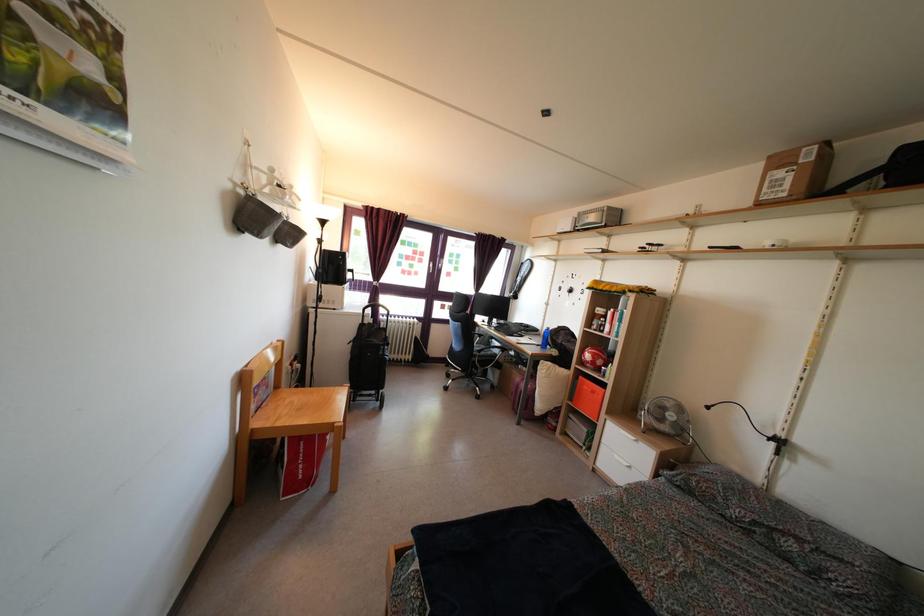
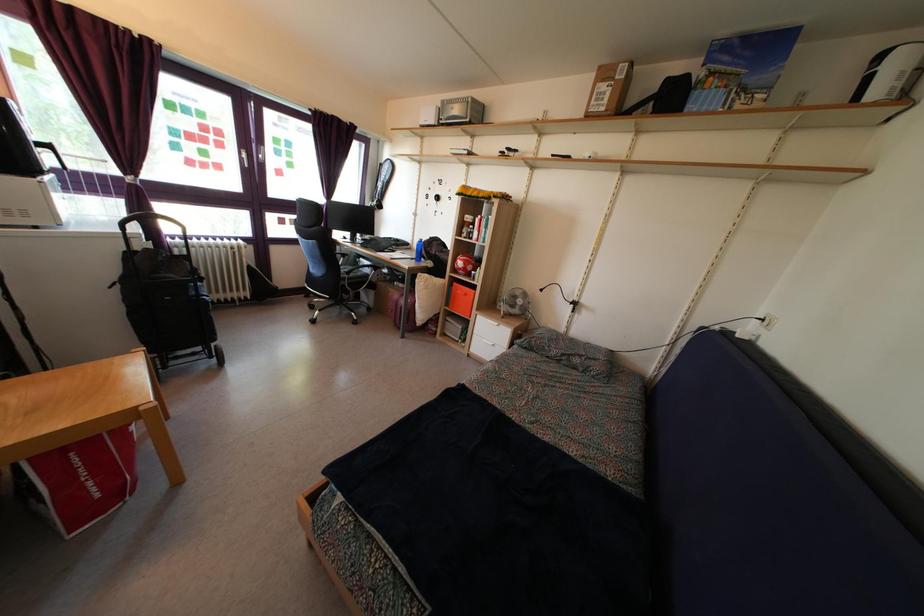
Find the pixel in the second image that matches (x=482, y=344) in the first image.

(346, 264)